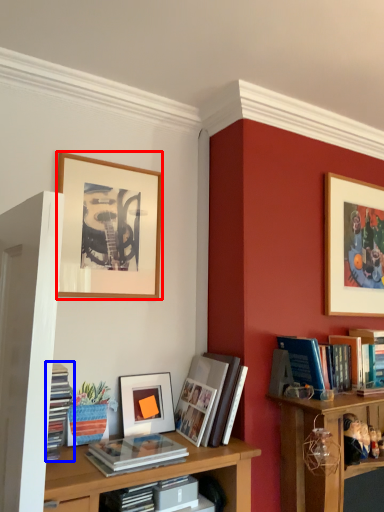
Question: Which object appears farthest to the camera in this image, picture frame (highlighted by a red box) or book (highlighted by a blue box)?

Choices:
 (A) picture frame
 (B) book

Answer: (A)